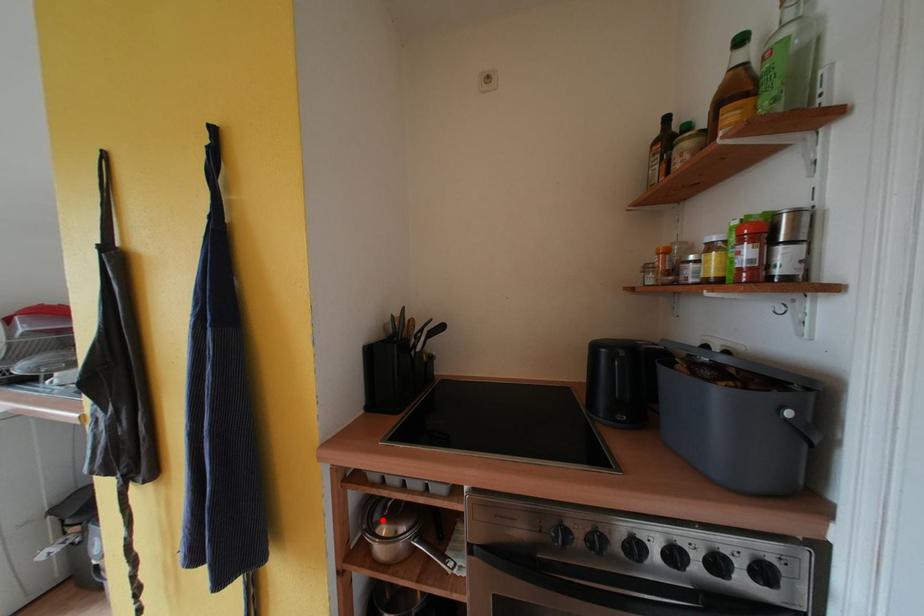
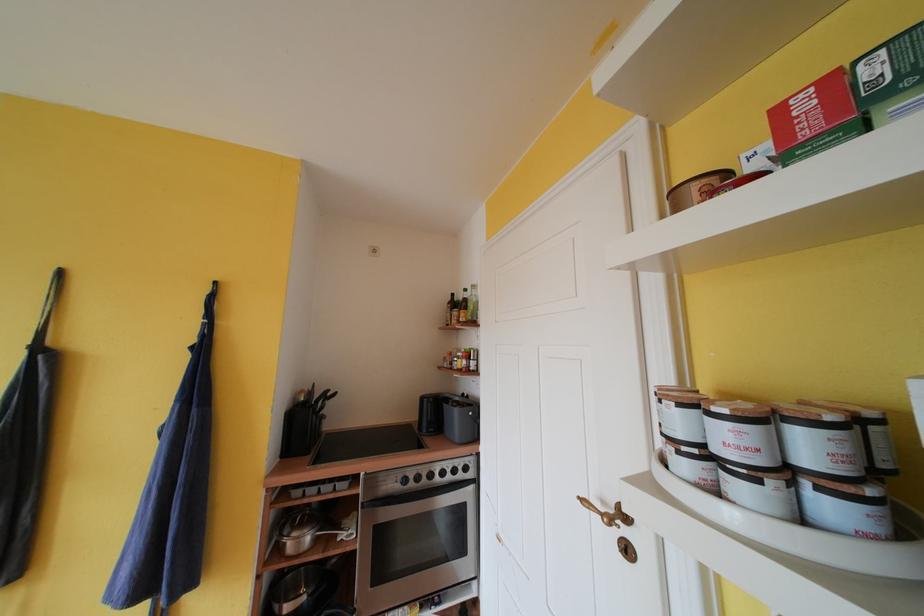
The point at the highlighted location is marked in the first image. Where is the corresponding point in the second image?

(293, 535)